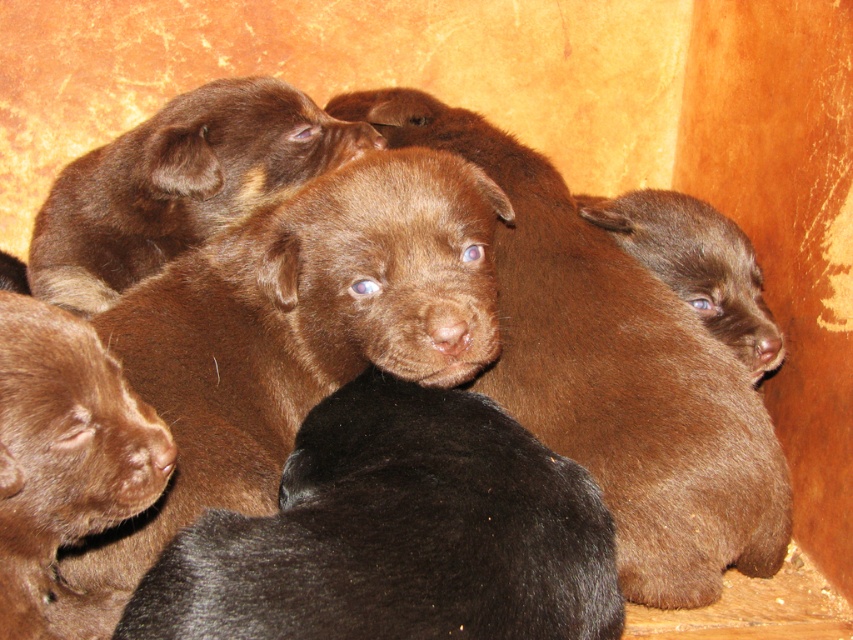
Question: Is the position of brown furry puppy at center more distant than that of brown fur puppy at center?

Choices:
 (A) yes
 (B) no

Answer: (B)

Question: Among these objects, which one is farthest from the camera?

Choices:
 (A) brown fur puppy at center
 (B) brown furry puppy at center

Answer: (A)

Question: Is brown furry puppy at center further to camera compared to brown fur puppy at center?

Choices:
 (A) no
 (B) yes

Answer: (A)

Question: Which point is farther to the camera?

Choices:
 (A) (755, 280)
 (B) (204, 129)

Answer: (A)

Question: Is brown furry puppy at center positioned in front of brown fur puppy at center?

Choices:
 (A) no
 (B) yes

Answer: (B)